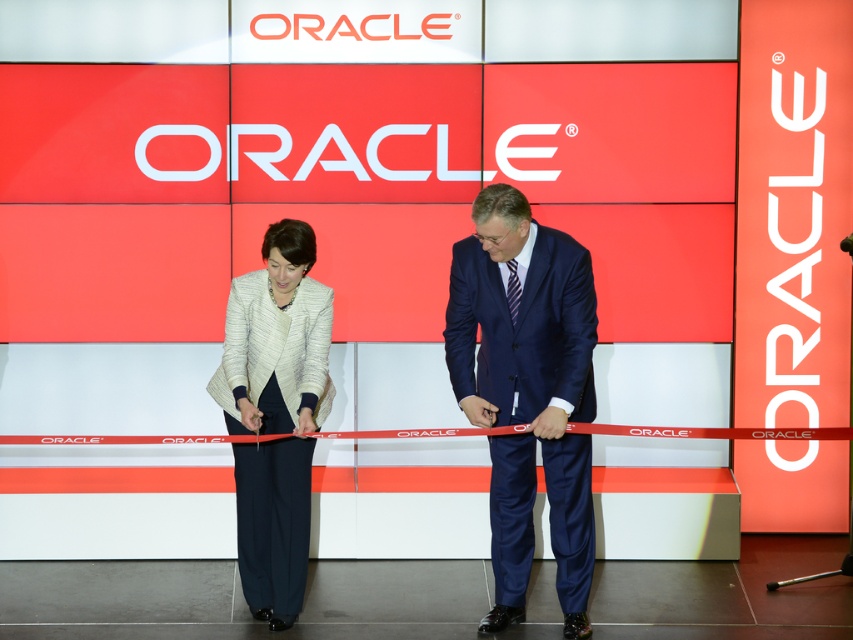
Question: Does navy blue suit at center appear over white textured blazer at center?

Choices:
 (A) yes
 (B) no

Answer: (A)

Question: From the image, what is the correct spatial relationship of navy blue suit at center in relation to white textured blazer at center?

Choices:
 (A) right
 (B) left

Answer: (A)

Question: Which of the following is the farthest from the observer?

Choices:
 (A) navy blue suit at center
 (B) white textured blazer at center

Answer: (B)

Question: Is navy blue suit at center behind white textured blazer at center?

Choices:
 (A) yes
 (B) no

Answer: (B)

Question: Among these objects, which one is farthest from the camera?

Choices:
 (A) white textured blazer at center
 (B) navy blue suit at center

Answer: (A)